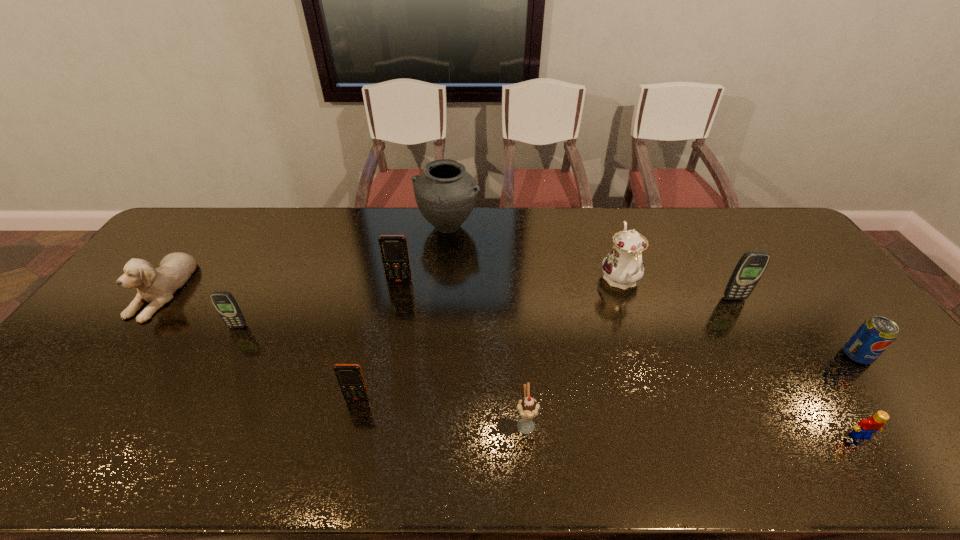
At what (x,y) coordinates should I click in order to perform the action: click on free spot between the rightmost cellular telephone and the bigger orange cellular telephone. Please return your answer as a coordinate pair (x, y). Image resolution: width=960 pixels, height=540 pixels. Looking at the image, I should click on (566, 289).

Locate an element on the screen. The height and width of the screenshot is (540, 960). vacant area that lies between the rightmost cellular telephone and the third farthest cellular telephone is located at coordinates (486, 312).

The height and width of the screenshot is (540, 960). I want to click on blank region between the farthest cellular telephone and the puppy, so click(x=281, y=285).

Find the location of a particular element. The width and height of the screenshot is (960, 540). free space between the second object from left to right and the fourth object from right to left is located at coordinates (429, 303).

The width and height of the screenshot is (960, 540). Find the location of `vacant area between the red Lego and the white puppy`. vacant area between the red Lego and the white puppy is located at coordinates (511, 362).

Where is `free spot between the second object from right to left and the black urn`? free spot between the second object from right to left and the black urn is located at coordinates (654, 331).

I want to click on vacant point located between the leftmost cellular telephone and the farthest cellular telephone, so click(319, 304).

Locate an element on the screen. The height and width of the screenshot is (540, 960). vacant area between the white puppy and the nearer orange cellular telephone is located at coordinates (260, 343).

I want to click on object that is the ninth closest to the icecream, so click(x=156, y=286).

Select which object appears as the fourth closest to the third nearest cellular telephone. Please provide its 2D coordinates. Your answer should be formatted as a tuple, i.e. [(x, y)], where the tuple contains the x and y coordinates of a point satisfying the conditions above.

[(528, 408)]